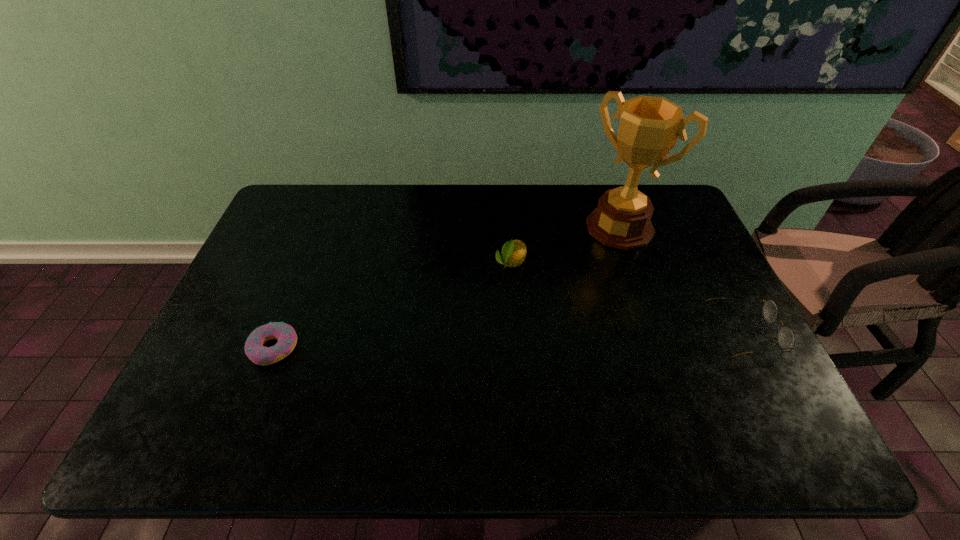
Identify the location of vacant space in between the leftmost object and the third object from right to left. This screenshot has width=960, height=540. (392, 306).

The width and height of the screenshot is (960, 540). What are the coordinates of `free space between the doughnut and the rightmost object` in the screenshot? It's located at (509, 341).

Where is `vacant space in between the shortest object and the rightmost object`? vacant space in between the shortest object and the rightmost object is located at coordinates (509, 341).

Where is `free space between the third nearest object and the third tallest object`? free space between the third nearest object and the third tallest object is located at coordinates (628, 298).

This screenshot has width=960, height=540. I want to click on object identified as the third closest to the rightmost object, so click(x=285, y=334).

Identify the location of object that stands as the closest to the tallest object. This screenshot has height=540, width=960. (513, 253).

Locate an element on the screen. free region that satisfies the following two spatial constraints: 1. on the front side of the rightmost object; 2. on the temples of the award is located at coordinates (656, 333).

Locate an element on the screen. vacant region that satisfies the following two spatial constraints: 1. on the back side of the second tallest object; 2. on the right side of the shortest object is located at coordinates [306, 264].

The width and height of the screenshot is (960, 540). I want to click on free spot that satisfies the following two spatial constraints: 1. on the front side of the spectacles; 2. on the temples of the third shortest object, so click(516, 333).

You are a GUI agent. You are given a task and a screenshot of the screen. Output one action in this format:
    pyautogui.click(x=<x>, y=<y>)
    Task: Click on the vacant space that satisfies the following two spatial constraints: 1. on the back side of the award; 2. on the right side of the third object from right to left
    This screenshot has width=960, height=540.
    Given the screenshot: What is the action you would take?
    pyautogui.click(x=508, y=227)